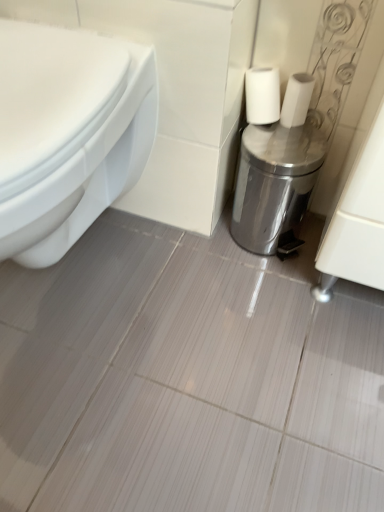
Question: Should I look upward or downward to see white matte toilet paper at center?

Choices:
 (A) up
 (B) down

Answer: (A)

Question: Is white glossy toilet at left taller than silver metallic trash can at right?

Choices:
 (A) no
 (B) yes

Answer: (B)

Question: Are white glossy toilet at left and silver metallic trash can at right far apart?

Choices:
 (A) yes
 (B) no

Answer: (B)

Question: From a real-world perspective, is white glossy toilet at left on top of silver metallic trash can at right?

Choices:
 (A) no
 (B) yes

Answer: (B)

Question: Considering the relative positions of white glossy toilet at left and silver metallic trash can at right in the image provided, is white glossy toilet at left to the left of silver metallic trash can at right from the viewer's perspective?

Choices:
 (A) no
 (B) yes

Answer: (B)

Question: Does white glossy toilet at left lie behind silver metallic trash can at right?

Choices:
 (A) yes
 (B) no

Answer: (B)

Question: Is white glossy toilet at left next to silver metallic trash can at right?

Choices:
 (A) no
 (B) yes

Answer: (A)

Question: From a real-world perspective, is white glossy toilet at left on top of white matte toilet paper at center?

Choices:
 (A) yes
 (B) no

Answer: (B)

Question: Is white matte toilet paper at center at the back of white glossy toilet at left?

Choices:
 (A) yes
 (B) no

Answer: (B)

Question: From a real-world perspective, is white glossy toilet at left beneath white matte toilet paper at center?

Choices:
 (A) yes
 (B) no

Answer: (A)

Question: Does white glossy toilet at left lie in front of white matte toilet paper at center?

Choices:
 (A) no
 (B) yes

Answer: (B)

Question: Is white glossy toilet at left completely or partially outside of white matte toilet paper at center?

Choices:
 (A) no
 (B) yes

Answer: (B)

Question: From the image's perspective, is white glossy toilet at left located beneath white matte toilet paper at center?

Choices:
 (A) no
 (B) yes

Answer: (B)

Question: From the image's perspective, is white matte toilet paper at center on top of white glossy toilet at left?

Choices:
 (A) no
 (B) yes

Answer: (B)